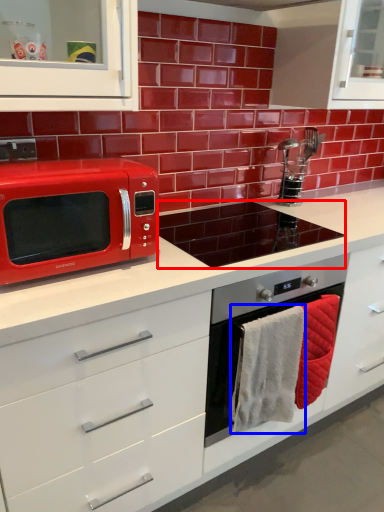
Question: Among these objects, which one is farthest to the camera, appliance (highlighted by a red box) or hand towel (highlighted by a blue box)?

Choices:
 (A) appliance
 (B) hand towel

Answer: (A)